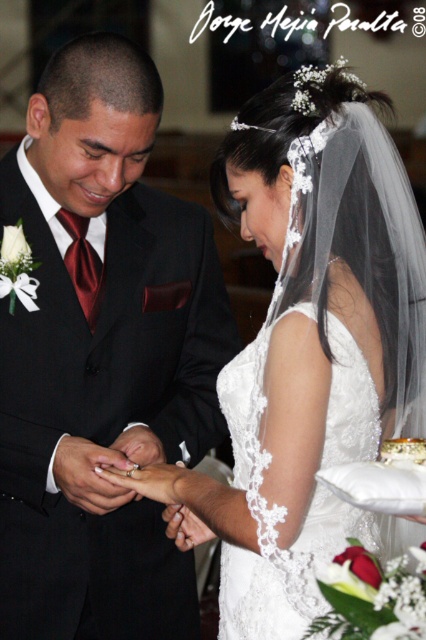
You are a photographer at the wedding ceremony. You need to capture a closeup shot of the rings and the groom. However, the matte black suit at center is blocking your view. Can you move the silver metallic ring at center to the side so it doesn not block the view? Explain why or why not based on their sizes.

The matte black suit at center is wider than the silver metallic ring at center. Therefore, moving the silver metallic ring at center might not resolve the issue since the wider matte black suit at center is the main obstruction.

You are a photographer at the wedding ceremony. You need to capture a closeup shot of the white textured cake at center and the silver metallic ring at center. Which object should you zoom in on to ensure both are in frame without moving the camera?

The white textured cake at center might be wider than silver metallic ring at center, so you should zoom in on the cake to ensure both are in frame without moving the camera.

You are a photographer at the wedding ceremony. You need to capture a closeup shot of the silver metallic ring at center without the matte black suit at center appearing in the background. Is this possible given their relative sizes?

The matte black suit at center is taller than the silver metallic ring at center, so it might block the view of the ring if positioned directly behind it. Adjust the angle to ensure the ring is framed away from the suit.